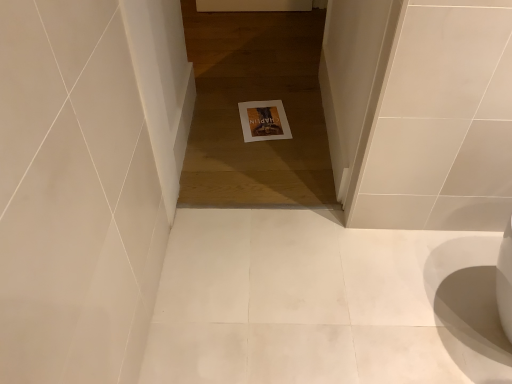
The image size is (512, 384). Find the location of `free space in front of white paper at center`. free space in front of white paper at center is located at coordinates (262, 152).